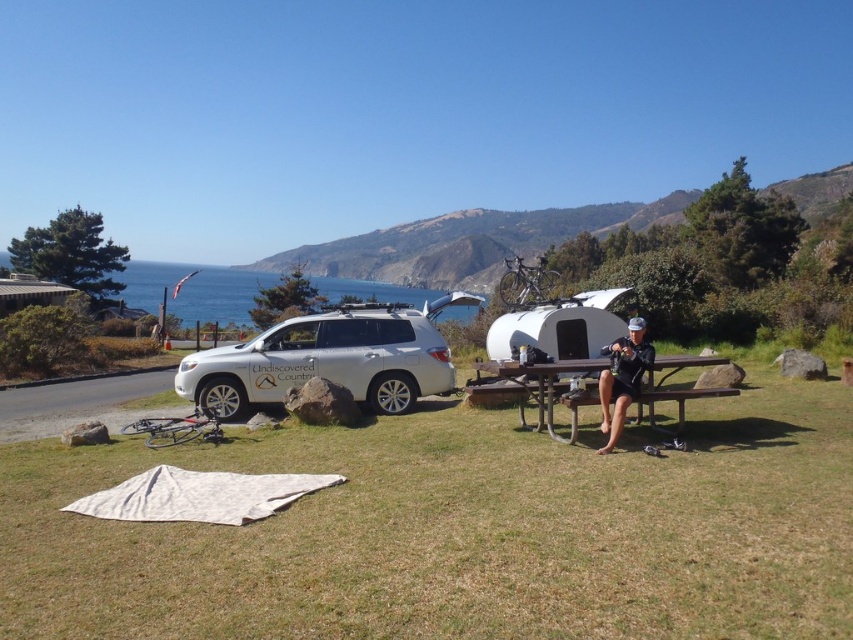
Who is taller, black matte shorts at center or metallic silver trailer at center?

Standing taller between the two is metallic silver trailer at center.

Which is more to the right, black matte shorts at center or metallic silver trailer at center?

metallic silver trailer at center is more to the right.

Image resolution: width=853 pixels, height=640 pixels. What do you see at coordinates (622, 378) in the screenshot? I see `black matte shorts at center` at bounding box center [622, 378].

The width and height of the screenshot is (853, 640). Find the location of `black matte shorts at center`. black matte shorts at center is located at coordinates (622, 378).

Is green grass at lower center smaller than black matte shorts at center?

Correct, green grass at lower center occupies less space than black matte shorts at center.

Is green grass at lower center above black matte shorts at center?

Incorrect, green grass at lower center is not positioned above black matte shorts at center.

Measure the distance between green grass at lower center and camera.

3.48 meters

What are the coordinates of `green grass at lower center` in the screenshot? It's located at (459, 531).

Which is above, green grass at lower center or blue water at upper left?

Positioned higher is blue water at upper left.

Which is behind, point (451, 568) or point (201, 292)?

Positioned behind is point (201, 292).

In order to click on green grass at lower center in this screenshot , I will do `click(459, 531)`.